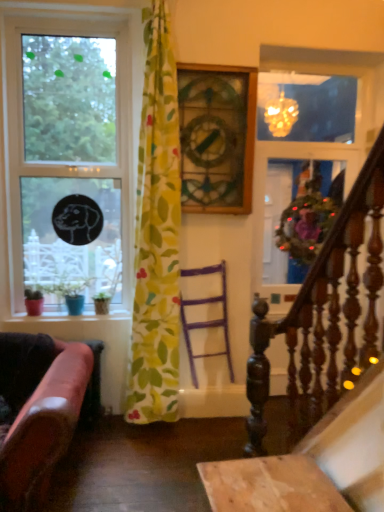
Question: Is clear glass window at left thinner than yellow floral fabric at center?

Choices:
 (A) no
 (B) yes

Answer: (B)

Question: Is clear glass window at left to the left of yellow floral fabric at center from the viewer's perspective?

Choices:
 (A) yes
 (B) no

Answer: (A)

Question: Is clear glass window at left taller than yellow floral fabric at center?

Choices:
 (A) no
 (B) yes

Answer: (A)

Question: Is clear glass window at left not inside yellow floral fabric at center?

Choices:
 (A) yes
 (B) no

Answer: (A)

Question: Considering the relative sizes of clear glass window at left and yellow floral fabric at center in the image provided, is clear glass window at left wider than yellow floral fabric at center?

Choices:
 (A) no
 (B) yes

Answer: (A)

Question: Considering the relative positions of clear glass window at left and yellow floral fabric at center in the image provided, is clear glass window at left to the right of yellow floral fabric at center from the viewer's perspective?

Choices:
 (A) no
 (B) yes

Answer: (A)

Question: Can you confirm if clear glass window at left is shorter than dark wood railing at right?

Choices:
 (A) yes
 (B) no

Answer: (B)

Question: Does clear glass window at left appear on the left side of dark wood railing at right?

Choices:
 (A) no
 (B) yes

Answer: (B)

Question: From a real-world perspective, is clear glass window at left physically below dark wood railing at right?

Choices:
 (A) no
 (B) yes

Answer: (A)

Question: Would you say dark wood railing at right is part of clear glass window at left's contents?

Choices:
 (A) no
 (B) yes

Answer: (A)

Question: Can you confirm if clear glass window at left is wider than dark wood railing at right?

Choices:
 (A) yes
 (B) no

Answer: (A)

Question: Is clear glass window at left located outside dark wood railing at right?

Choices:
 (A) yes
 (B) no

Answer: (A)

Question: Is purple wood chair at center further to camera compared to leather at left?

Choices:
 (A) no
 (B) yes

Answer: (B)